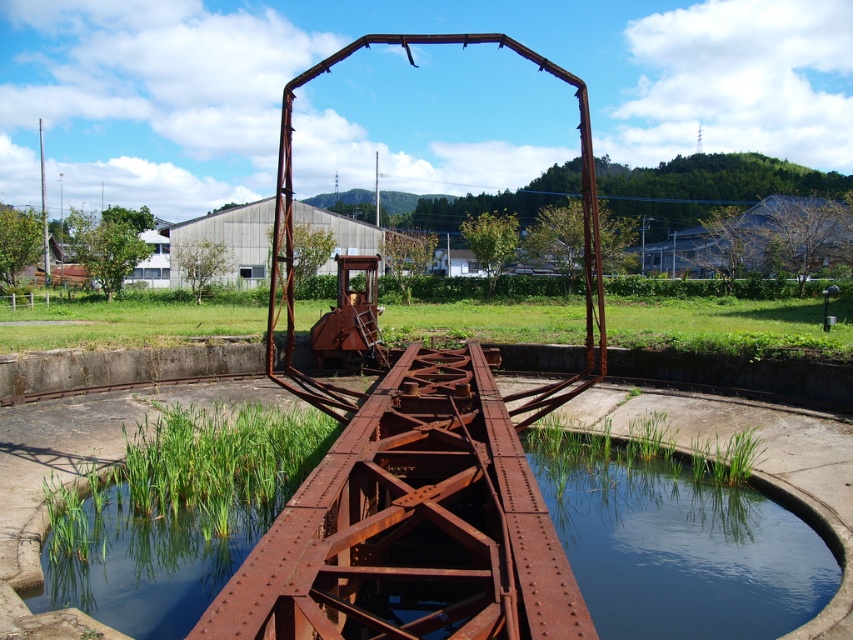
Question: Is rusty metal pond at center thinner than clear water at bottom center?

Choices:
 (A) yes
 (B) no

Answer: (B)

Question: Which of the following is the farthest from the observer?

Choices:
 (A) clear water at bottom center
 (B) rusty metal pond at center
 (C) rusty metal rail at center

Answer: (A)

Question: Is rusty metal rail at center above clear water at bottom center?

Choices:
 (A) no
 (B) yes

Answer: (B)

Question: Which of the following is the farthest from the observer?

Choices:
 (A) (564, 579)
 (B) (648, 506)
 (C) (822, 560)

Answer: (B)

Question: Can you confirm if rusty metal pond at center is wider than clear water at bottom center?

Choices:
 (A) no
 (B) yes

Answer: (B)

Question: Which of the following is the closest to the observer?

Choices:
 (A) rusty metal pond at center
 (B) clear water at bottom center

Answer: (A)